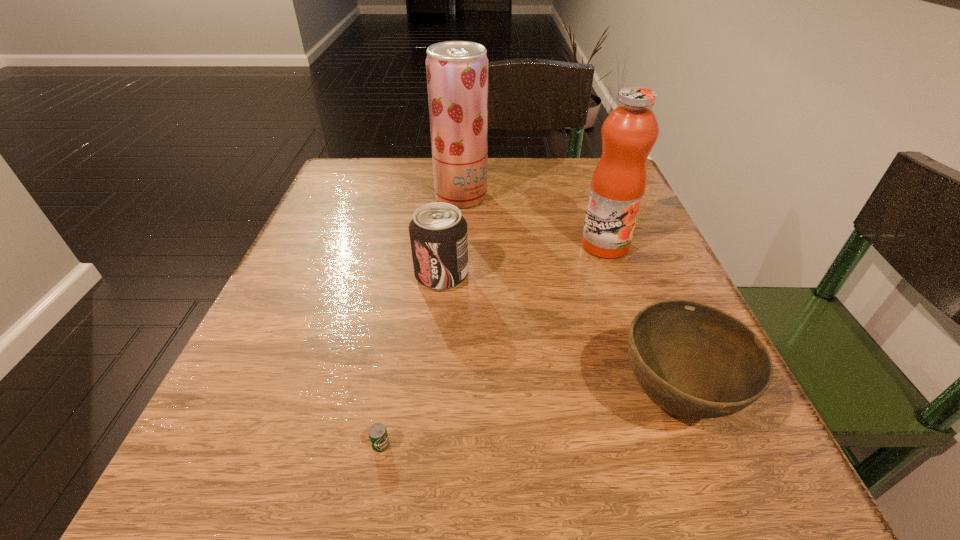
This screenshot has height=540, width=960. I want to click on blank space located 0.380m on the back of the shortest object, so click(x=419, y=238).

Find the location of `object that is positioned at the far edge`. object that is positioned at the far edge is located at coordinates (457, 71).

Where is `bowl positioned at the near edge`? bowl positioned at the near edge is located at coordinates (695, 361).

At what (x,y) coordinates should I click in order to perform the action: click on beer can at the near edge. Please return your answer as a coordinate pair (x, y). The height and width of the screenshot is (540, 960). Looking at the image, I should click on (378, 435).

You are a GUI agent. You are given a task and a screenshot of the screen. Output one action in this format:
    pyautogui.click(x=<x>, y=<y>)
    Task: Click on the fruit juice located in the right edge section of the desktop
    The image size is (960, 540).
    Given the screenshot: What is the action you would take?
    pyautogui.click(x=629, y=132)

Locate an element on the screen. bowl that is at the right edge is located at coordinates (695, 361).

The image size is (960, 540). I want to click on object that is at the near right corner, so tap(695, 361).

This screenshot has height=540, width=960. In the image, there is a desktop. Find the location of `vacant space at the near edge`. vacant space at the near edge is located at coordinates (415, 519).

At what (x,y) coordinates should I click in order to perform the action: click on vacant region at the left edge of the desktop. Please return your answer as a coordinate pair (x, y). The image size is (960, 540). Looking at the image, I should click on (254, 349).

In the image, there is a desktop. Identify the location of vacant space at the right edge. (672, 415).